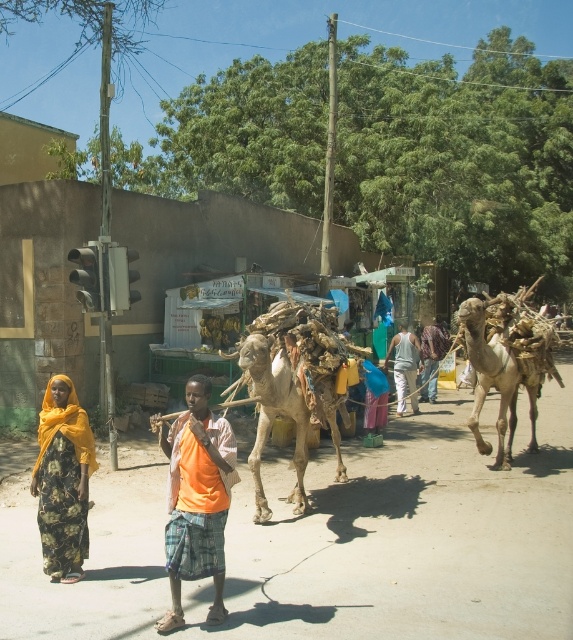
You are standing at the center of the street and want to pick up both the orange fabric at center and the light gray cotton tank top at center. If your reach is 10 feet, can you grab both items without moving your feet?

The orange fabric at center is 32.41 feet away from light gray cotton tank top at center. Since your reach is only 10 feet, you cannot reach both items without moving your feet because they are too far apart.

You are a photographer positioned at the front of the scene. You want to take a photo that includes both the orange fabric at center and the light gray cotton tank top at center. Which object should you adjust your focus on first to ensure both are in the frame?

The orange fabric at center is closer to the viewer than the light gray cotton tank top at center, so you should focus on the orange fabric at center first to ensure depth of field captures both objects.

You are a traveler standing on the right side of the street. You see the orange fabric at center and the rustic wooden stick at center. Which object is closer to your left side?

The orange fabric at center is closer to your left side because it is positioned to the left of the rustic wooden stick at center.